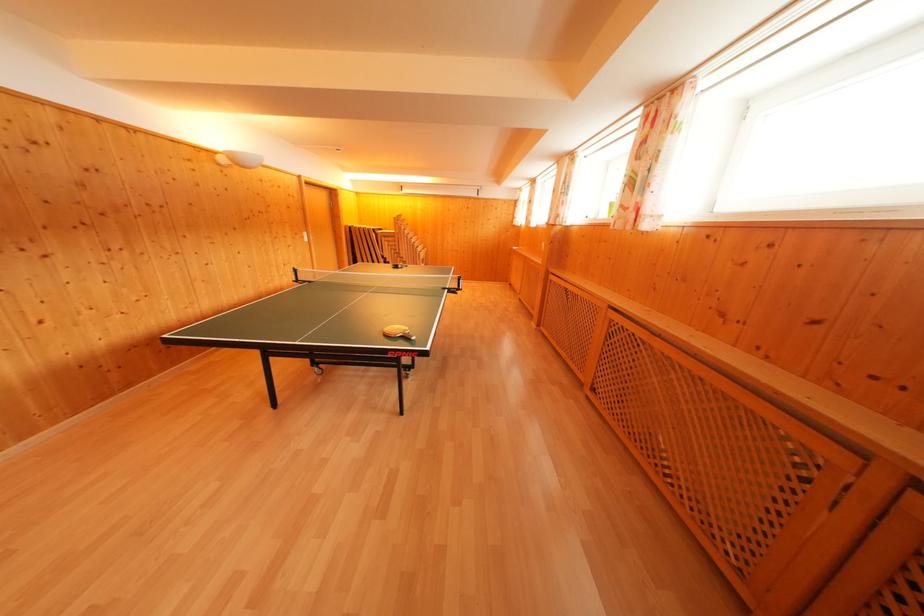
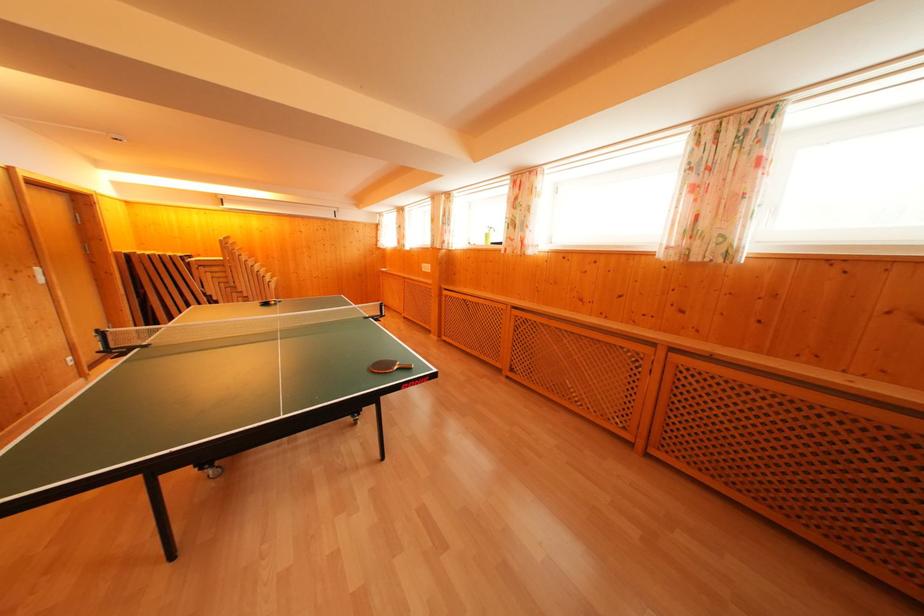
The point at (387, 262) is marked in the first image. Where is the corresponding point in the second image?

(210, 300)